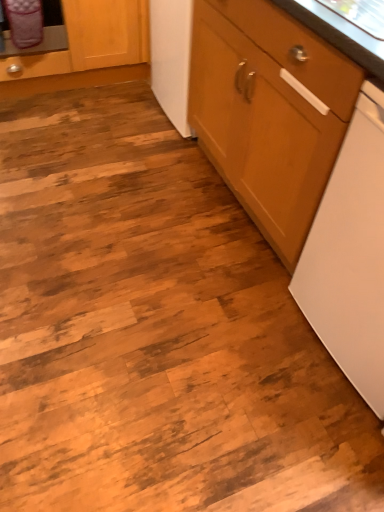
The image size is (384, 512). Describe the element at coordinates (86, 50) in the screenshot. I see `wooden cabinet at upper left, the first cabinetry when ordered from left to right` at that location.

Locate an element on the screen. wooden cabinet at upper left, arranged as the 2th cabinetry when viewed from the right is located at coordinates coord(86,50).

Which is behind, point (254, 160) or point (64, 17)?

Positioned behind is point (64, 17).

In the scene shown: Which is behind, wooden cabinet at right, the first cabinetry positioned from the right, or wooden cabinet at upper left, arranged as the 2th cabinetry when viewed from the right?

wooden cabinet at upper left, arranged as the 2th cabinetry when viewed from the right, is behind.

Are wooden cabinet at right, the 2th cabinetry positioned from the left, and wooden cabinet at upper left, arranged as the 2th cabinetry when viewed from the right, making contact?

No.

Does wooden cabinet at right, the first cabinetry positioned from the right, have a greater width compared to wooden cabinet at upper left, the first cabinetry when ordered from left to right?

Incorrect, the width of wooden cabinet at right, the first cabinetry positioned from the right, does not surpass that of wooden cabinet at upper left, the first cabinetry when ordered from left to right.

From the image's perspective, which cabinetry is the 2nd one above the white matte dishwasher at right? Please provide its 2D coordinates.

[(86, 50)]

Is wooden cabinet at upper left, arranged as the 2th cabinetry when viewed from the right, smaller than white matte dishwasher at right?

Incorrect, wooden cabinet at upper left, arranged as the 2th cabinetry when viewed from the right, is not smaller in size than white matte dishwasher at right.

Is wooden cabinet at upper left, arranged as the 2th cabinetry when viewed from the right, positioned behind white matte dishwasher at right?

Yes, wooden cabinet at upper left, arranged as the 2th cabinetry when viewed from the right, is behind white matte dishwasher at right.

Considering the positions of points (31, 88) and (364, 131), is point (31, 88) closer to camera compared to point (364, 131)?

No, (31, 88) is further to viewer.

Considering their positions, is white matte dishwasher at right located in front of or behind wooden cabinet at upper left, the first cabinetry when ordered from left to right?

In the image, white matte dishwasher at right appears in front of wooden cabinet at upper left, the first cabinetry when ordered from left to right.

Does white matte dishwasher at right appear on the left side of wooden cabinet at upper left, arranged as the 2th cabinetry when viewed from the right?

No, white matte dishwasher at right is not to the left of wooden cabinet at upper left, arranged as the 2th cabinetry when viewed from the right.

Considering the sizes of objects white matte dishwasher at right and wooden cabinet at upper left, the first cabinetry when ordered from left to right, in the image provided, who is taller, white matte dishwasher at right or wooden cabinet at upper left, the first cabinetry when ordered from left to right,?

With more height is white matte dishwasher at right.

In the image, there is a white matte dishwasher at right. Where is `cabinetry below it (from a real-world perspective)`? The height and width of the screenshot is (512, 384). cabinetry below it (from a real-world perspective) is located at coordinates (86, 50).

Visually, is white matte dishwasher at right positioned to the left or to the right of wooden cabinet at right, the first cabinetry positioned from the right?

white matte dishwasher at right is positioned on wooden cabinet at right, the first cabinetry positioned from the right,'s right side.

Is white matte dishwasher at right facing towards wooden cabinet at right, the 2th cabinetry positioned from the left?

No.

Considering the sizes of objects white matte dishwasher at right and wooden cabinet at right, the 2th cabinetry positioned from the left, in the image provided, who is shorter, white matte dishwasher at right or wooden cabinet at right, the 2th cabinetry positioned from the left,?

With less height is white matte dishwasher at right.

Can you confirm if wooden cabinet at upper left, the first cabinetry when ordered from left to right, is wider than wooden cabinet at right, the 2th cabinetry positioned from the left?

Yes.

Are wooden cabinet at upper left, arranged as the 2th cabinetry when viewed from the right, and wooden cabinet at right, the 2th cabinetry positioned from the left, located far from each other?

Yes, wooden cabinet at upper left, arranged as the 2th cabinetry when viewed from the right, and wooden cabinet at right, the 2th cabinetry positioned from the left, are quite far apart.

Which point is more distant from viewer, (x=3, y=59) or (x=216, y=5)?

The point (x=3, y=59) is farther from the camera.

Between wooden cabinet at upper left, the first cabinetry when ordered from left to right, and wooden cabinet at right, the 2th cabinetry positioned from the left, which one is positioned behind?

Positioned behind is wooden cabinet at upper left, the first cabinetry when ordered from left to right.

Considering the sizes of objects wooden cabinet at right, the first cabinetry positioned from the right, and white matte dishwasher at right in the image provided, who is smaller, wooden cabinet at right, the first cabinetry positioned from the right, or white matte dishwasher at right?

white matte dishwasher at right.

Is wooden cabinet at right, the first cabinetry positioned from the right, in front of or behind white matte dishwasher at right in the image?

In the image, wooden cabinet at right, the first cabinetry positioned from the right, appears behind white matte dishwasher at right.

Is wooden cabinet at right, the 2th cabinetry positioned from the left, with white matte dishwasher at right?

wooden cabinet at right, the 2th cabinetry positioned from the left, and white matte dishwasher at right are clearly separated.

From the picture: From the image's perspective, is wooden cabinet at right, the 2th cabinetry positioned from the left, above or below white matte dishwasher at right?

wooden cabinet at right, the 2th cabinetry positioned from the left, is above white matte dishwasher at right.

This screenshot has width=384, height=512. I want to click on cabinetry on the right side of wooden cabinet at upper left, the first cabinetry when ordered from left to right, so click(269, 112).

Image resolution: width=384 pixels, height=512 pixels. In the image, there is a wooden cabinet at upper left, the first cabinetry when ordered from left to right. Identify the location of home appliance below it (from the image's perspective). (351, 255).

Consider the image. Based on their spatial positions, is white matte dishwasher at right or wooden cabinet at upper left, arranged as the 2th cabinetry when viewed from the right, further from wooden cabinet at right, the 2th cabinetry positioned from the left?

wooden cabinet at upper left, arranged as the 2th cabinetry when viewed from the right, lies further to wooden cabinet at right, the 2th cabinetry positioned from the left, than the other object.

Considering their positions, is wooden cabinet at upper left, arranged as the 2th cabinetry when viewed from the right, positioned further to wooden cabinet at right, the 2th cabinetry positioned from the left, than white matte dishwasher at right?

wooden cabinet at upper left, arranged as the 2th cabinetry when viewed from the right.

Considering their positions, is white matte dishwasher at right positioned further to wooden cabinet at upper left, arranged as the 2th cabinetry when viewed from the right, than wooden cabinet at right, the first cabinetry positioned from the right?

The object further to wooden cabinet at upper left, arranged as the 2th cabinetry when viewed from the right, is white matte dishwasher at right.

Based on their spatial positions, is wooden cabinet at right, the first cabinetry positioned from the right, or white matte dishwasher at right further from wooden cabinet at upper left, arranged as the 2th cabinetry when viewed from the right?

Based on the image, white matte dishwasher at right appears to be further to wooden cabinet at upper left, arranged as the 2th cabinetry when viewed from the right.

Looking at this image, estimate the real-world distances between objects in this image. Which object is further from white matte dishwasher at right, wooden cabinet at upper left, arranged as the 2th cabinetry when viewed from the right, or wooden cabinet at right, the first cabinetry positioned from the right?

wooden cabinet at upper left, arranged as the 2th cabinetry when viewed from the right, is further to white matte dishwasher at right.

When comparing their distances from white matte dishwasher at right, does wooden cabinet at right, the first cabinetry positioned from the right, or wooden cabinet at upper left, arranged as the 2th cabinetry when viewed from the right, seem further?

Among the two, wooden cabinet at upper left, arranged as the 2th cabinetry when viewed from the right, is located further to white matte dishwasher at right.

Where is `cabinetry between wooden cabinet at upper left, arranged as the 2th cabinetry when viewed from the right, and white matte dishwasher at right`? cabinetry between wooden cabinet at upper left, arranged as the 2th cabinetry when viewed from the right, and white matte dishwasher at right is located at coordinates (269, 112).